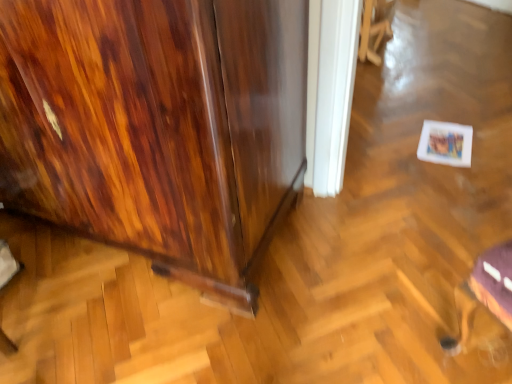
Question: Considering the relative sizes of metallic silver swivel chair at lower right, the 2th swivel chair viewed from the back, and wooden swivel chair at upper center, acting as the 1th swivel chair starting from the back, in the image provided, is metallic silver swivel chair at lower right, the 2th swivel chair viewed from the back, thinner than wooden swivel chair at upper center, acting as the 1th swivel chair starting from the back,?

Choices:
 (A) no
 (B) yes

Answer: (A)

Question: Is metallic silver swivel chair at lower right, the first swivel chair when ordered from front to back, positioned before wooden swivel chair at upper center, positioned as the 2th swivel chair in front-to-back order?

Choices:
 (A) no
 (B) yes

Answer: (B)

Question: From a real-world perspective, is metallic silver swivel chair at lower right, which is the first swivel chair in bottom-to-top order, on top of wooden swivel chair at upper center, positioned as the 2th swivel chair in front-to-back order?

Choices:
 (A) yes
 (B) no

Answer: (A)

Question: Is metallic silver swivel chair at lower right, the 2th swivel chair viewed from the back, surrounding wooden swivel chair at upper center, which is the first swivel chair in top-to-bottom order?

Choices:
 (A) no
 (B) yes

Answer: (A)

Question: Is metallic silver swivel chair at lower right, the 2th swivel chair viewed from the back, behind wooden swivel chair at upper center, the 2th swivel chair in the bottom-to-top sequence?

Choices:
 (A) yes
 (B) no

Answer: (B)

Question: From a real-world perspective, relative to wooden cabinet at left, is wooden swivel chair at upper center, which is the first swivel chair in top-to-bottom order, vertically above or below?

Choices:
 (A) below
 (B) above

Answer: (A)

Question: Is wooden swivel chair at upper center, positioned as the 2th swivel chair in front-to-back order, inside or outside of wooden cabinet at left?

Choices:
 (A) outside
 (B) inside

Answer: (A)

Question: Looking at their shapes, would you say wooden swivel chair at upper center, positioned as the 2th swivel chair in front-to-back order, is wider or thinner than wooden cabinet at left?

Choices:
 (A) wide
 (B) thin

Answer: (B)

Question: Considering the positions of point (366, 56) and point (276, 213), is point (366, 56) closer or farther from the camera than point (276, 213)?

Choices:
 (A) closer
 (B) farther

Answer: (B)

Question: From the image's perspective, relative to metallic silver swivel chair at lower right, which is the first swivel chair in bottom-to-top order, is wooden swivel chair at upper center, which is the first swivel chair in top-to-bottom order, above or below?

Choices:
 (A) above
 (B) below

Answer: (A)

Question: In terms of size, does wooden swivel chair at upper center, which is the first swivel chair in top-to-bottom order, appear bigger or smaller than metallic silver swivel chair at lower right, the 2th swivel chair viewed from the back?

Choices:
 (A) small
 (B) big

Answer: (B)

Question: Is point (381, 6) closer or farther from the camera than point (497, 246)?

Choices:
 (A) closer
 (B) farther

Answer: (B)

Question: In the image, is wooden swivel chair at upper center, which is the first swivel chair in top-to-bottom order, positioned in front of or behind metallic silver swivel chair at lower right, the first swivel chair when ordered from front to back?

Choices:
 (A) front
 (B) behind

Answer: (B)

Question: Considering the positions of wooden cabinet at left and metallic silver swivel chair at lower right, arranged as the 2th swivel chair when viewed from the top, in the image, is wooden cabinet at left wider or thinner than metallic silver swivel chair at lower right, arranged as the 2th swivel chair when viewed from the top,?

Choices:
 (A) wide
 (B) thin

Answer: (A)

Question: In terms of height, does wooden cabinet at left look taller or shorter compared to metallic silver swivel chair at lower right, arranged as the 2th swivel chair when viewed from the top?

Choices:
 (A) short
 (B) tall

Answer: (B)